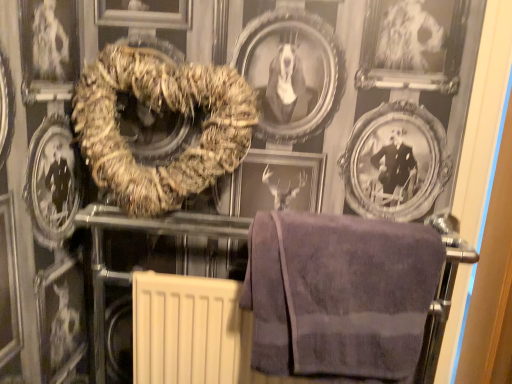
This screenshot has height=384, width=512. What do you see at coordinates (160, 112) in the screenshot?
I see `brown textured towel at center, positioned as the first towel in top-to-bottom order` at bounding box center [160, 112].

At what (x,y) coordinates should I click in order to perform the action: click on brown textured towel at center, which appears as the second towel when viewed from the right. Please return your answer as a coordinate pair (x, y). Looking at the image, I should click on (160, 112).

In order to face brown textured towel at center, marked as the second towel in a bottom-to-top arrangement, should I rotate leftwards or rightwards?

Rotate left and turn 12.262 degrees.

At what (x,y) coordinates should I click in order to perform the action: click on purple terry cloth towel at lower right, which appears as the 1th towel when viewed from the right. Please return your answer as a coordinate pair (x, y). The width and height of the screenshot is (512, 384). Looking at the image, I should click on coord(339,294).

The width and height of the screenshot is (512, 384). What do you see at coordinates (339, 294) in the screenshot?
I see `purple terry cloth towel at lower right, placed as the second towel when sorted from top to bottom` at bounding box center [339, 294].

You are a GUI agent. You are given a task and a screenshot of the screen. Output one action in this format:
    pyautogui.click(x=<x>, y=<y>)
    Task: Click on the brown textured towel at center, marked as the second towel in a bottom-to-top arrangement
    This screenshot has width=512, height=384.
    Given the screenshot: What is the action you would take?
    pyautogui.click(x=160, y=112)

Based on their positions, is purple terry cloth towel at lower right, placed as the second towel when sorted from top to bottom, located to the left or right of brown textured towel at center, marked as the second towel in a bottom-to-top arrangement?

In the image, purple terry cloth towel at lower right, placed as the second towel when sorted from top to bottom, appears on the right side of brown textured towel at center, marked as the second towel in a bottom-to-top arrangement.

Between purple terry cloth towel at lower right, placed as the second towel when sorted from top to bottom, and brown textured towel at center, positioned as the first towel in top-to-bottom order, which one is positioned behind?

brown textured towel at center, positioned as the first towel in top-to-bottom order, is more distant.

Considering the positions of point (295, 266) and point (183, 82), is point (295, 266) closer or farther from the camera than point (183, 82)?

Point (295, 266) is closer to the camera than point (183, 82).

From the image's perspective, does purple terry cloth towel at lower right, which is counted as the 2th towel, starting from the left, appear higher than brown textured towel at center, arranged as the first towel when viewed from the left?

Incorrect, from the image's perspective, purple terry cloth towel at lower right, which is counted as the 2th towel, starting from the left, is lower than brown textured towel at center, arranged as the first towel when viewed from the left.

From a real-world perspective, is purple terry cloth towel at lower right, which is counted as the 2th towel, starting from the left, on top of brown textured towel at center, which appears as the second towel when viewed from the right?

No, from a real-world perspective, purple terry cloth towel at lower right, which is counted as the 2th towel, starting from the left, is not on top of brown textured towel at center, which appears as the second towel when viewed from the right.

Between purple terry cloth towel at lower right, which appears as the 1th towel when viewed from the right, and brown textured towel at center, which appears as the second towel when viewed from the right, which one has larger width?

Wider between the two is purple terry cloth towel at lower right, which appears as the 1th towel when viewed from the right.

Is purple terry cloth towel at lower right, placed as the second towel when sorted from top to bottom, taller than brown textured towel at center, arranged as the first towel when viewed from the left?

In fact, purple terry cloth towel at lower right, placed as the second towel when sorted from top to bottom, may be shorter than brown textured towel at center, arranged as the first towel when viewed from the left.

Can you confirm if purple terry cloth towel at lower right, which appears as the 1th towel when viewed from the right, is bigger than brown textured towel at center, arranged as the first towel when viewed from the left?

No, purple terry cloth towel at lower right, which appears as the 1th towel when viewed from the right, is not bigger than brown textured towel at center, arranged as the first towel when viewed from the left.

Is brown textured towel at center, positioned as the first towel in top-to-bottom order, located within purple terry cloth towel at lower right, which appears as the 1th towel when viewed from the right?

No, brown textured towel at center, positioned as the first towel in top-to-bottom order, is not a part of purple terry cloth towel at lower right, which appears as the 1th towel when viewed from the right.

Are purple terry cloth towel at lower right, which appears as the 1th towel when ordered from the bottom, and brown textured towel at center, which appears as the second towel when viewed from the right, located far from each other?

purple terry cloth towel at lower right, which appears as the 1th towel when ordered from the bottom, is near brown textured towel at center, which appears as the second towel when viewed from the right, not far away.

Could you tell me if purple terry cloth towel at lower right, which is counted as the 2th towel, starting from the left, is facing brown textured towel at center, arranged as the first towel when viewed from the left?

No.

How much distance is there between purple terry cloth towel at lower right, which is counted as the 2th towel, starting from the left, and brown textured towel at center, arranged as the first towel when viewed from the left?

purple terry cloth towel at lower right, which is counted as the 2th towel, starting from the left, and brown textured towel at center, arranged as the first towel when viewed from the left, are 13.11 inches apart.

Where is `towel on the right of brown textured towel at center, marked as the second towel in a bottom-to-top arrangement`? This screenshot has width=512, height=384. towel on the right of brown textured towel at center, marked as the second towel in a bottom-to-top arrangement is located at coordinates (339, 294).

Based on their positions, is brown textured towel at center, positioned as the first towel in top-to-bottom order, located to the left or right of purple terry cloth towel at lower right, placed as the second towel when sorted from top to bottom?

Based on their positions, brown textured towel at center, positioned as the first towel in top-to-bottom order, is located to the left of purple terry cloth towel at lower right, placed as the second towel when sorted from top to bottom.

From the picture: Is brown textured towel at center, marked as the second towel in a bottom-to-top arrangement, in front of or behind purple terry cloth towel at lower right, which is counted as the 2th towel, starting from the left, in the image?

Clearly, brown textured towel at center, marked as the second towel in a bottom-to-top arrangement, is behind purple terry cloth towel at lower right, which is counted as the 2th towel, starting from the left.

Does point (222, 136) lie in front of point (396, 298)?

That is False.

From the image's perspective, does brown textured towel at center, marked as the second towel in a bottom-to-top arrangement, appear higher than purple terry cloth towel at lower right, which is counted as the 2th towel, starting from the left?

Indeed, from the image's perspective, brown textured towel at center, marked as the second towel in a bottom-to-top arrangement, is shown above purple terry cloth towel at lower right, which is counted as the 2th towel, starting from the left.

From a real-world perspective, is brown textured towel at center, arranged as the first towel when viewed from the left, beneath purple terry cloth towel at lower right, which appears as the 1th towel when viewed from the right?

No.

Looking at this image, between brown textured towel at center, arranged as the first towel when viewed from the left, and purple terry cloth towel at lower right, which is counted as the 2th towel, starting from the left, which one has smaller width?

Thinner between the two is brown textured towel at center, arranged as the first towel when viewed from the left.

From the picture: Is brown textured towel at center, which appears as the second towel when viewed from the right, shorter than purple terry cloth towel at lower right, placed as the second towel when sorted from top to bottom?

No, brown textured towel at center, which appears as the second towel when viewed from the right, is not shorter than purple terry cloth towel at lower right, placed as the second towel when sorted from top to bottom.

Who is bigger, brown textured towel at center, which appears as the second towel when viewed from the right, or purple terry cloth towel at lower right, which appears as the 1th towel when ordered from the bottom?

brown textured towel at center, which appears as the second towel when viewed from the right.

Choose the correct answer: Is brown textured towel at center, arranged as the first towel when viewed from the left, inside purple terry cloth towel at lower right, which appears as the 1th towel when viewed from the right, or outside it?

brown textured towel at center, arranged as the first towel when viewed from the left, cannot be found inside purple terry cloth towel at lower right, which appears as the 1th towel when viewed from the right.

Is brown textured towel at center, positioned as the first towel in top-to-bottom order, far from purple terry cloth towel at lower right, placed as the second towel when sorted from top to bottom?

No.

Does brown textured towel at center, arranged as the first towel when viewed from the left, turn towards purple terry cloth towel at lower right, which appears as the 1th towel when ordered from the bottom?

No, brown textured towel at center, arranged as the first towel when viewed from the left, is not aimed at purple terry cloth towel at lower right, which appears as the 1th towel when ordered from the bottom.

This screenshot has width=512, height=384. Identify the location of towel above the purple terry cloth towel at lower right, which is counted as the 2th towel, starting from the left (from a real-world perspective). (160, 112).

You are a GUI agent. You are given a task and a screenshot of the screen. Output one action in this format:
    pyautogui.click(x=<x>, y=<y>)
    Task: Click on the towel in front of the brown textured towel at center, which appears as the second towel when viewed from the right
    
    Given the screenshot: What is the action you would take?
    pyautogui.click(x=339, y=294)

Find the location of a particular element. towel behind the purple terry cloth towel at lower right, placed as the second towel when sorted from top to bottom is located at coordinates (160, 112).